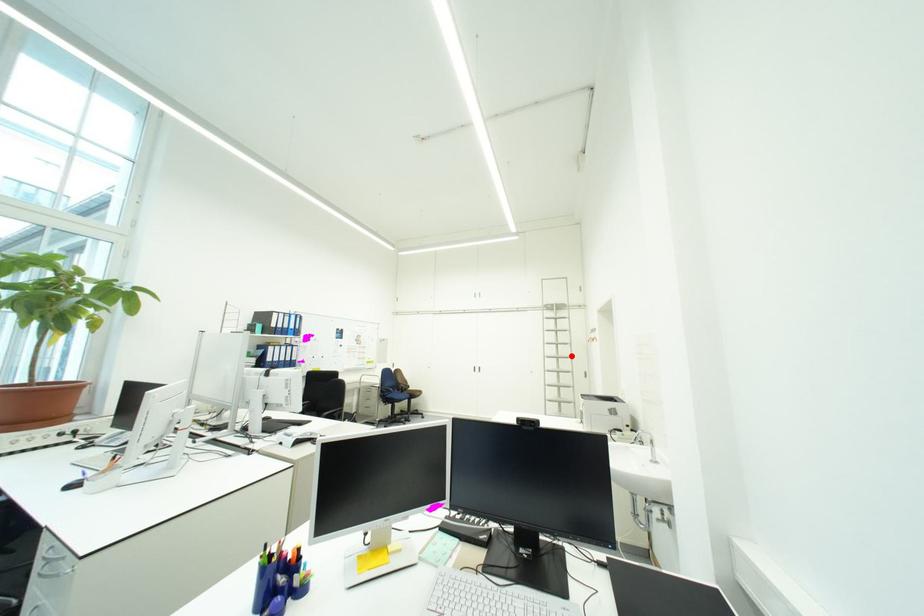
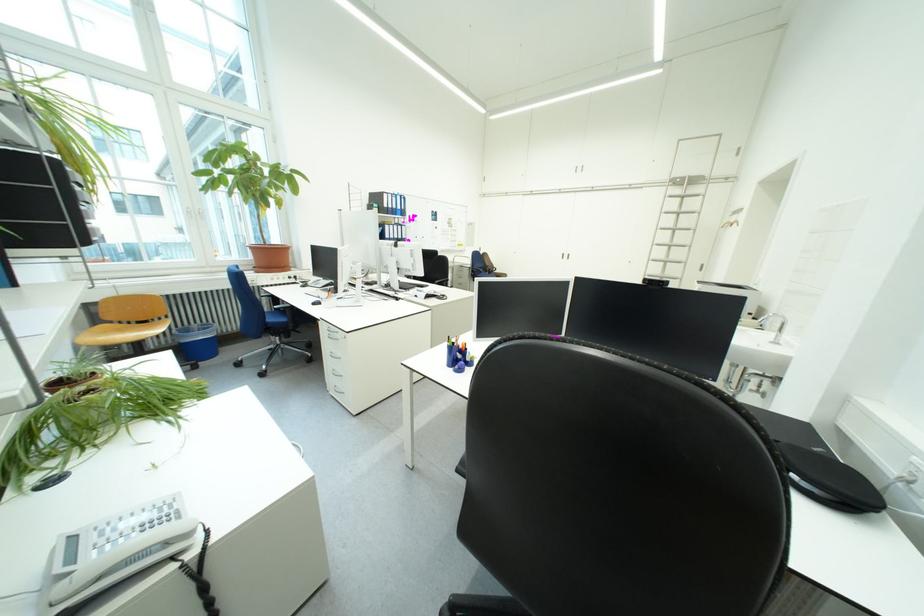
The point at the highlighted location is marked in the first image. Where is the corresponding point in the second image?

(687, 244)